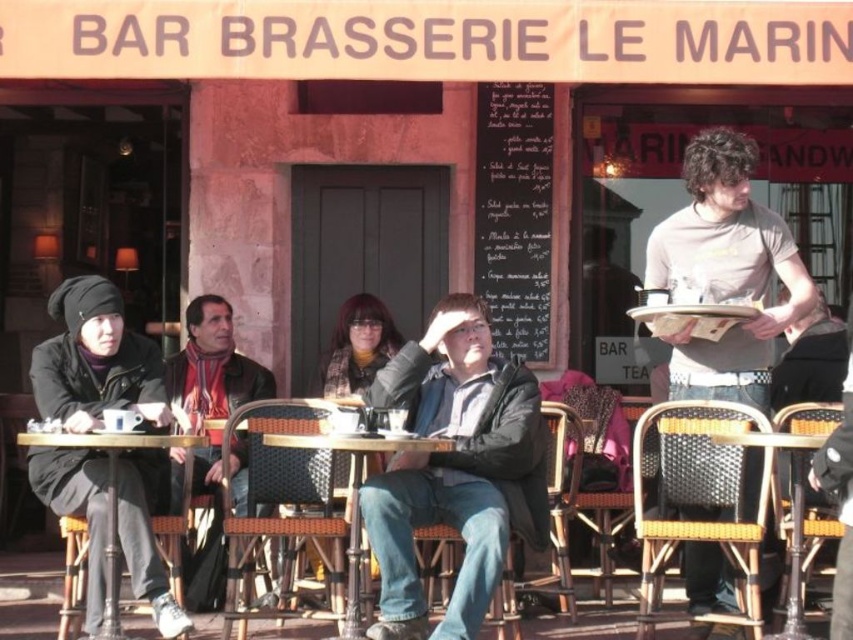
Which is above, leather jacket at center or gray t-shirt at right?

Positioned higher is gray t-shirt at right.

Can you confirm if leather jacket at center is shorter than gray t-shirt at right?

Correct, leather jacket at center is not as tall as gray t-shirt at right.

This screenshot has height=640, width=853. What do you see at coordinates (456, 468) in the screenshot?
I see `leather jacket at center` at bounding box center [456, 468].

Locate an element on the screen. leather jacket at center is located at coordinates (456, 468).

Is leather jacket at center smaller than woven wicker table at center?

Actually, leather jacket at center might be larger than woven wicker table at center.

Between point (442, 452) and point (793, 627), which one is positioned behind?

Point (442, 452)

The height and width of the screenshot is (640, 853). I want to click on leather jacket at center, so click(456, 468).

Is gray t-shirt at right bigger than dark brown leather jacket at center?

No.

Does gray t-shirt at right appear over dark brown leather jacket at center?

Yes.

Is point (809, 282) behind point (207, 356)?

No, (809, 282) is closer to viewer.

The image size is (853, 640). In order to click on gray t-shirt at right in this screenshot , I will do `click(726, 273)`.